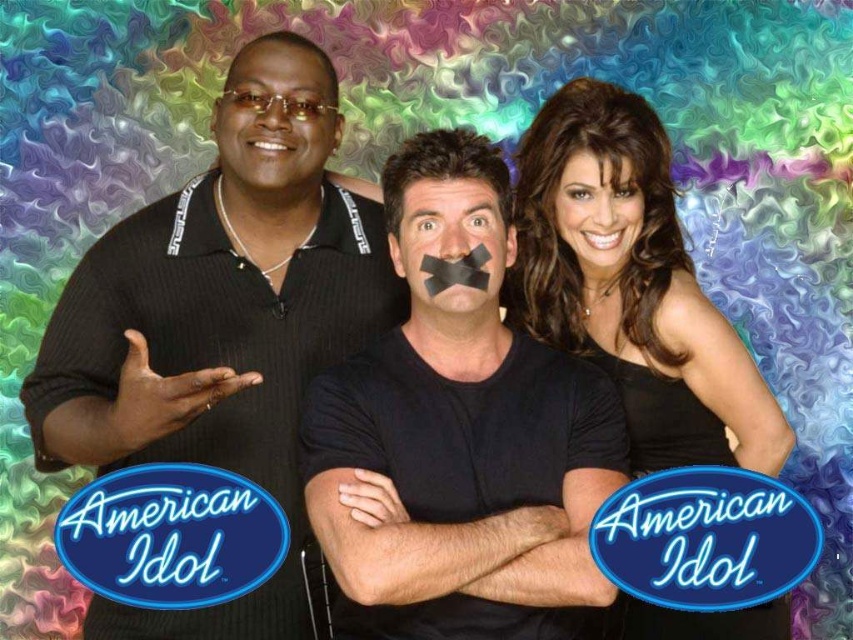
Question: Which point is closer to the camera?

Choices:
 (A) (619, 189)
 (B) (422, 157)
 (C) (219, 145)

Answer: (B)

Question: Is black matte t-shirt at center smaller than black satin dress at center?

Choices:
 (A) yes
 (B) no

Answer: (B)

Question: Which point is farther from the camera taking this photo?

Choices:
 (A) (445, 232)
 (B) (291, 161)
 (C) (405, 612)

Answer: (B)

Question: Does matte black face at left have a larger size compared to black matte tape at center?

Choices:
 (A) yes
 (B) no

Answer: (A)

Question: Is matte black face at left positioned at the back of black matte tape at center?

Choices:
 (A) yes
 (B) no

Answer: (A)

Question: Which object is farther from the camera taking this photo?

Choices:
 (A) smooth skin face at center
 (B) black matte t-shirt at center
 (C) black textured shirt at left

Answer: (A)